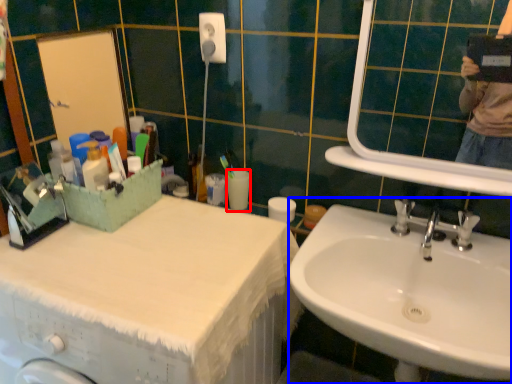
Question: Which object appears closest to the camera in this image, toilet paper (highlighted by a red box) or sink (highlighted by a blue box)?

Choices:
 (A) toilet paper
 (B) sink

Answer: (B)